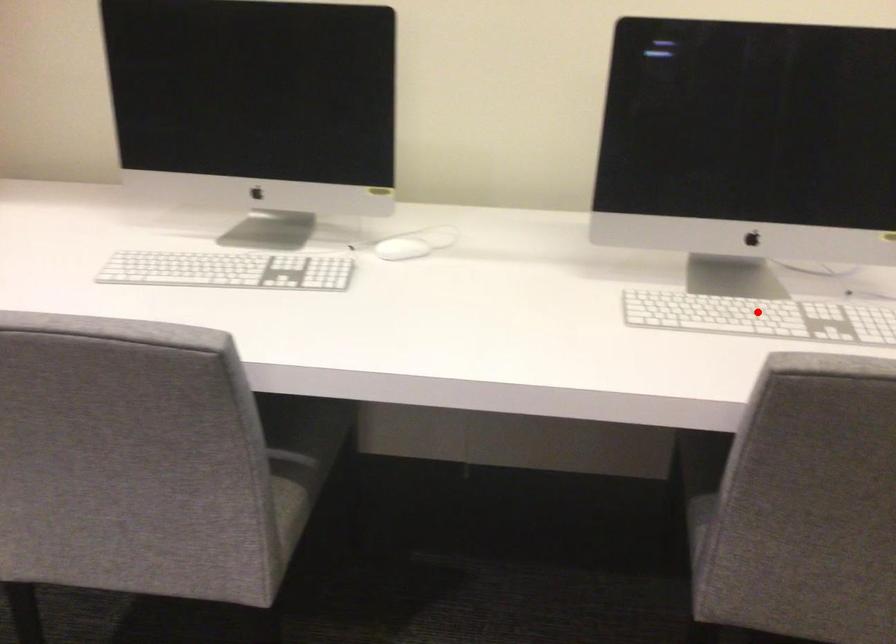
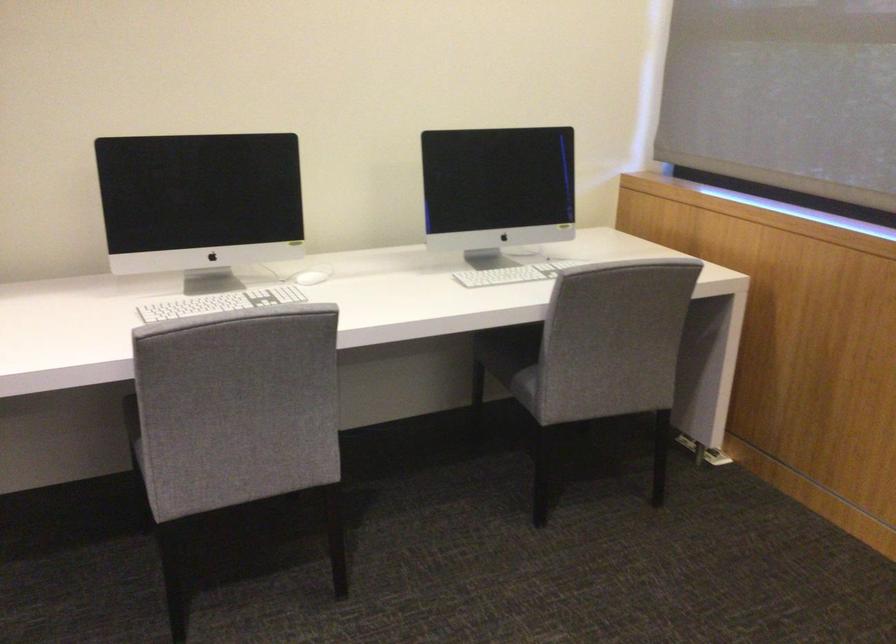
Locate, in the second image, the point that corresponds to the highlighted location in the first image.

(519, 270)